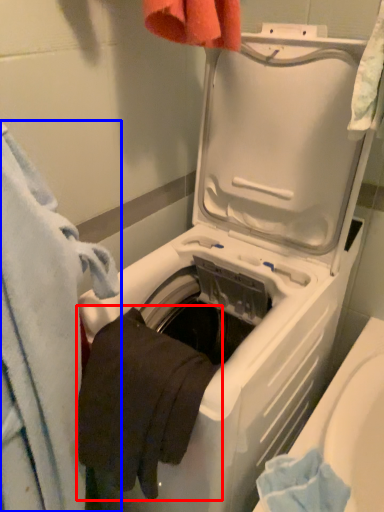
Question: Which of the following is the farthest to the observer, bath towel (highlighted by a red box) or towel (highlighted by a blue box)?

Choices:
 (A) bath towel
 (B) towel

Answer: (A)